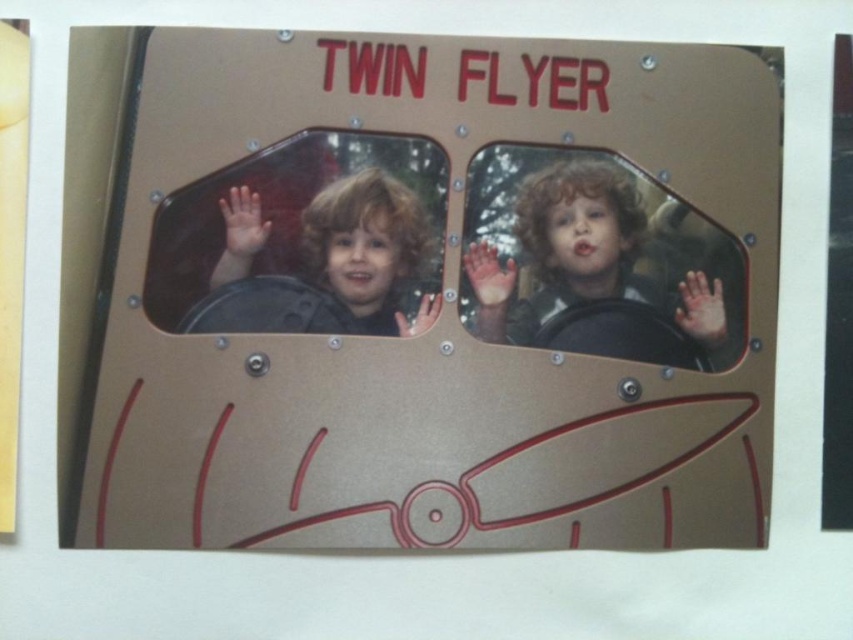
Based on the photo, you are a parent trying to help your child locate the steering wheel and helmet in the Twin Flyer cockpit. According to the image, where is the matte black steering wheel at center in relation to the matte black helmet at left?

The matte black steering wheel at center is positioned below the matte black helmet at left.

You are a parent trying to decide whether to let your child play in the cockpit. The child is 4 feet tall. The safety guidelines state that the child must be able to reach both the matte black steering wheel at center and the matte black helmet at left simultaneously to ensure proper control. Given their sizes, can the child reach both objects at the same time?

The matte black steering wheel at center is wider than the matte black helmet at left. Since the steering wheel is larger in width, it might require more space to maneuver, but the child can still reach both objects simultaneously as the guidelines donot specify size restrictions, only reachability.